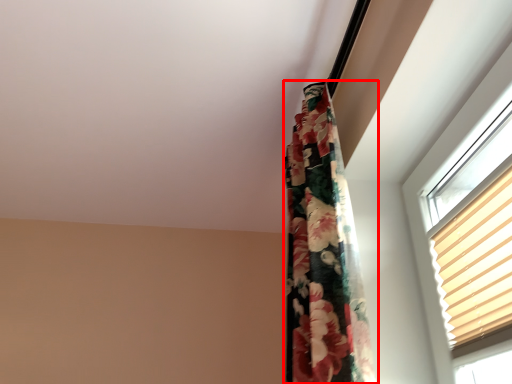
Question: From the image's perspective, where is curtain (annotated by the red box) located relative to blind?

Choices:
 (A) below
 (B) above

Answer: (B)